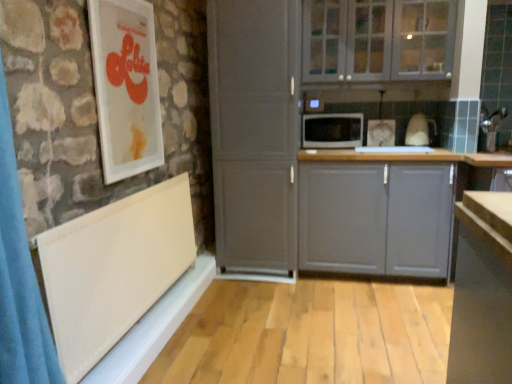
Find the location of a particular element. free space between gray matte cabinet at center, arranged as the 1th cabinetry when ordered from the bottom, and white textured window sill at lower left is located at coordinates (283, 320).